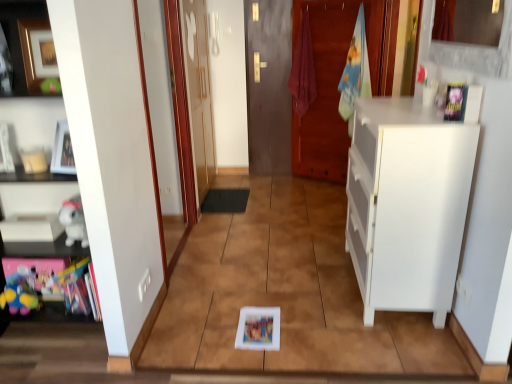
This screenshot has width=512, height=384. I want to click on free spot to the left of white matte cabinet at right, the first cabinetry viewed from the right, so click(x=298, y=266).